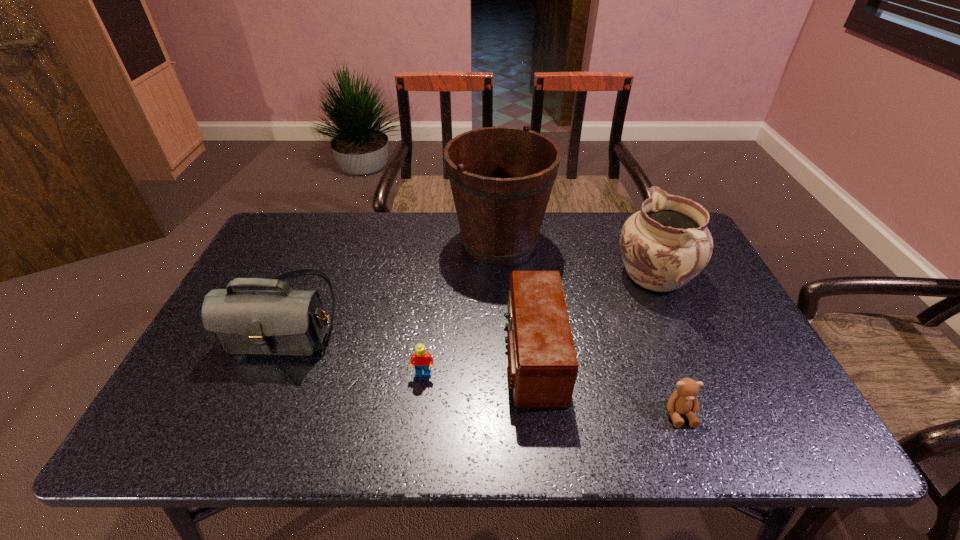
Where is `bucket`? bucket is located at coordinates (501, 178).

Identify the location of pitcher. The image size is (960, 540). (666, 244).

The width and height of the screenshot is (960, 540). I want to click on the leftmost object, so click(x=276, y=322).

You are a GUI agent. You are given a task and a screenshot of the screen. Output one action in this format:
    pyautogui.click(x=<x>, y=<y>)
    Task: Click on the radio receiver
    
    Given the screenshot: What is the action you would take?
    pyautogui.click(x=542, y=364)

The image size is (960, 540). In order to click on Lego in this screenshot , I will do `click(423, 361)`.

Locate an element on the screen. This screenshot has height=540, width=960. teddy bear is located at coordinates (682, 401).

Where is `free space located 0.120m on the right of the tallest object`? The height and width of the screenshot is (540, 960). free space located 0.120m on the right of the tallest object is located at coordinates [587, 241].

Where is `free space located on the spout of the pitcher`? free space located on the spout of the pitcher is located at coordinates (632, 225).

Where is `free space located on the spout of the pitcher`? free space located on the spout of the pitcher is located at coordinates (631, 221).

I want to click on vacant area situated 0.050m on the spout of the pitcher, so click(x=637, y=238).